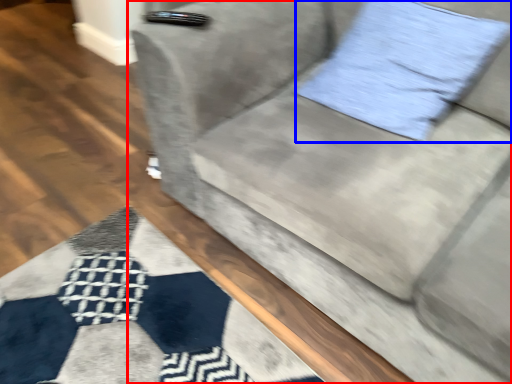
Question: Among these objects, which one is nearest to the camera, studio couch (highlighted by a red box) or pillow (highlighted by a blue box)?

Choices:
 (A) studio couch
 (B) pillow

Answer: (A)